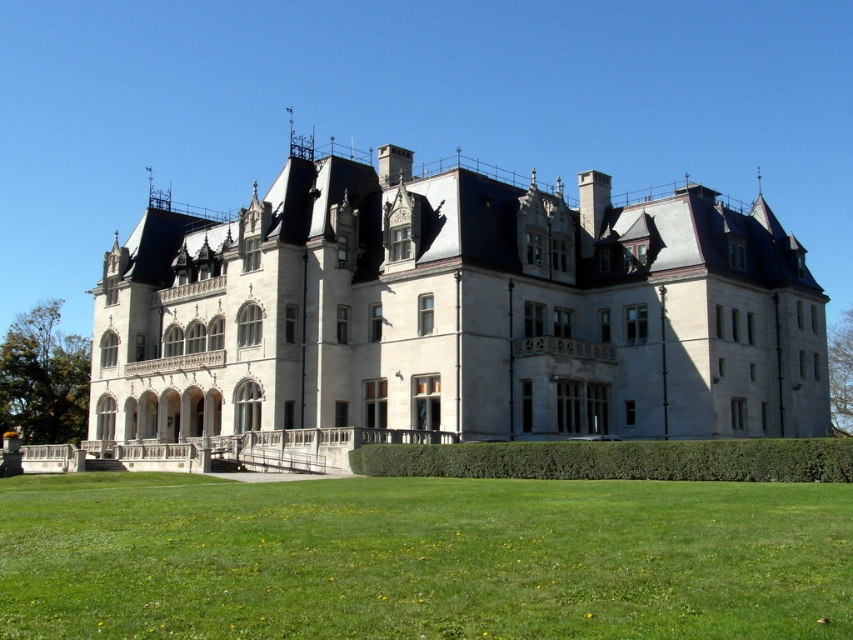
Question: Which object is positioned farthest from the green grass at lower center?

Choices:
 (A) green leafy hedge at lower center
 (B) stone mansion at center

Answer: (B)

Question: Does stone mansion at center have a greater width compared to green grass at lower center?

Choices:
 (A) no
 (B) yes

Answer: (B)

Question: Which point is closer to the camera taking this photo?

Choices:
 (A) (828, 465)
 (B) (108, 620)
 (C) (602, 180)

Answer: (B)

Question: Does green grass at lower center appear on the left side of green leafy hedge at lower center?

Choices:
 (A) no
 (B) yes

Answer: (B)

Question: Which object appears farthest from the camera in this image?

Choices:
 (A) green grass at lower center
 (B) stone mansion at center
 (C) green leafy hedge at lower center

Answer: (B)

Question: Where is green grass at lower center located in relation to green leafy hedge at lower center in the image?

Choices:
 (A) below
 (B) above

Answer: (A)